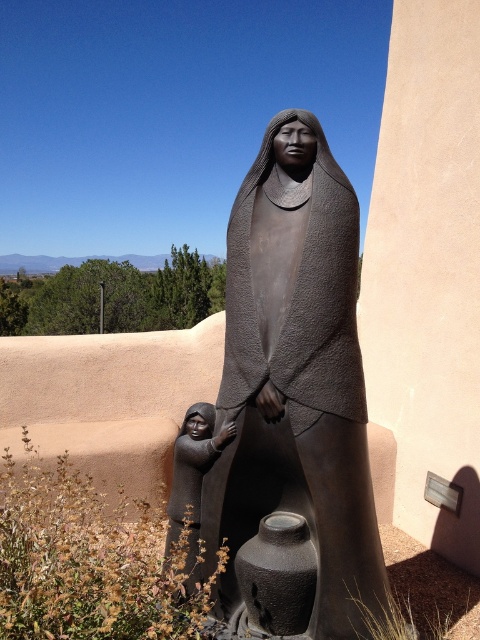
Question: Is matte bronze statue at center bigger than matte black figure at lower left?

Choices:
 (A) yes
 (B) no

Answer: (A)

Question: Among these points, which one is nearest to the camera?

Choices:
 (A) (193, 524)
 (B) (257, 481)

Answer: (B)

Question: Which point appears farthest from the camera in this image?

Choices:
 (A) (188, 465)
 (B) (313, 276)

Answer: (A)

Question: Does matte bronze statue at center appear on the right side of matte black figure at lower left?

Choices:
 (A) yes
 (B) no

Answer: (A)

Question: Is matte bronze statue at center above matte black figure at lower left?

Choices:
 (A) yes
 (B) no

Answer: (A)

Question: Which of the following is the closest to the observer?

Choices:
 (A) (179, 449)
 (B) (324, 529)

Answer: (B)